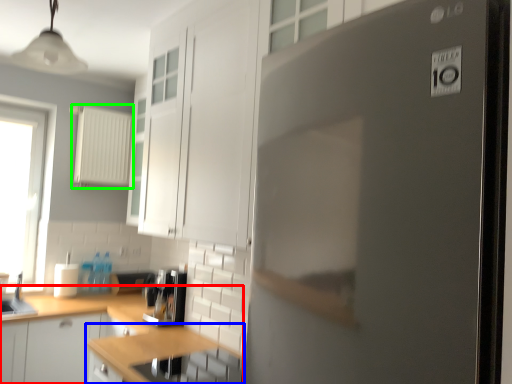
Question: Based on their relative distances, which object is nearer to cabinetry (highlighted by a red box)? Choose from countertop (highlighted by a blue box) and appliance (highlighted by a green box).

Choices:
 (A) countertop
 (B) appliance

Answer: (A)